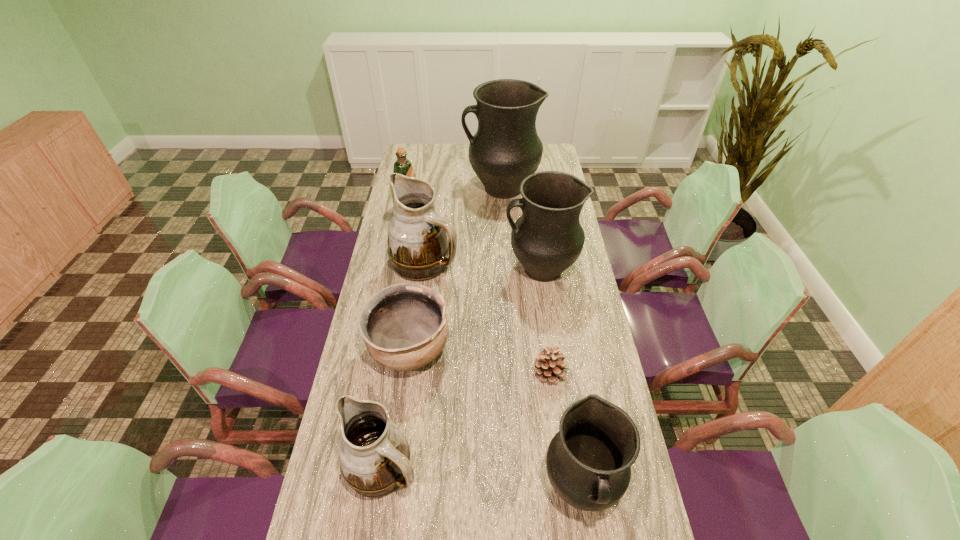
The image size is (960, 540). Identify the location of vacant area located 0.280m on the handle side of the tallest object. (403, 188).

This screenshot has height=540, width=960. Identify the location of vacant space located on the handle side of the tallest object. (401, 188).

Find the location of a particular element. The width and height of the screenshot is (960, 540). vacant area located on the handle side of the tallest object is located at coordinates (419, 188).

I want to click on free point located from the spout of the bigger brown pitcher, so click(564, 263).

The image size is (960, 540). I want to click on blank area located on the handle side of the second farthest black pitcher, so click(441, 269).

Find the location of a particular element. Image resolution: width=960 pixels, height=540 pixels. vacant space located 0.060m on the handle side of the second farthest black pitcher is located at coordinates (488, 269).

Identify the location of blank space located on the handle side of the second farthest black pitcher. (432, 269).

Identify the location of free space located on the front-facing side of the green olive oil. The image size is (960, 540). (501, 208).

Image resolution: width=960 pixels, height=540 pixels. In order to click on vacant region located from the spout of the smaller brown pitcher in this screenshot , I will do `click(495, 468)`.

At what (x,y) coordinates should I click in order to perform the action: click on free space located 0.340m on the right of the second shortest object. Please return your answer as a coordinate pair (x, y). The width and height of the screenshot is (960, 540). Looking at the image, I should click on (556, 350).